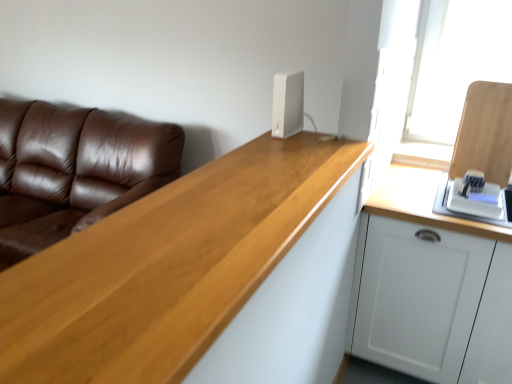
What do you see at coordinates (288, 104) in the screenshot? I see `white plastic router at upper center` at bounding box center [288, 104].

Identify the location of white plastic router at upper center. (288, 104).

Can you confirm if white plastic router at upper center is shorter than brown leather couch at left?

Indeed, white plastic router at upper center has a lesser height compared to brown leather couch at left.

In the image, is white plastic router at upper center positioned in front of or behind brown leather couch at left?

white plastic router at upper center is in front of brown leather couch at left.

Identify the location of appliance located above the brown leather couch at left (from a real-world perspective). (288, 104).

Is white plastic router at upper center in contact with brown leather couch at left?

white plastic router at upper center and brown leather couch at left are not in contact.

Is brown leather couch at left positioned far away from light wood countertop at center?

That's right, there is a large distance between brown leather couch at left and light wood countertop at center.

Is brown leather couch at left to the right of light wood countertop at center from the viewer's perspective?

Incorrect, brown leather couch at left is not on the right side of light wood countertop at center.

Is white plastic router at upper center not inside white matte cabinet at right?

Yes, white plastic router at upper center is located beyond the bounds of white matte cabinet at right.

Is white plastic router at upper center to the left or to the right of white matte cabinet at right in the image?

From the image, it's evident that white plastic router at upper center is to the left of white matte cabinet at right.

Can you see brown leather couch at left touching white plastic router at upper center?

No, brown leather couch at left is not with white plastic router at upper center.

Is brown leather couch at left wider than white plastic router at upper center?

Correct, the width of brown leather couch at left exceeds that of white plastic router at upper center.

From a real-world perspective, is brown leather couch at left beneath white plastic router at upper center?

Correct, in the physical world, brown leather couch at left is lower than white plastic router at upper center.

From the image's perspective, which is below, brown leather couch at left or white plastic router at upper center?

brown leather couch at left is shown below in the image.

Is white matte cabinet at right smaller than brown leather couch at left?

Indeed, white matte cabinet at right has a smaller size compared to brown leather couch at left.

Which of these two, white matte cabinet at right or brown leather couch at left, stands shorter?

white matte cabinet at right is shorter.

Is white matte cabinet at right far from brown leather couch at left?

Absolutely, white matte cabinet at right is distant from brown leather couch at left.

At what (x,y) coordinates should I click in order to perform the action: click on studio couch behind the white matte cabinet at right. Please return your answer as a coordinate pair (x, y). This screenshot has height=384, width=512. Looking at the image, I should click on (74, 170).

From the image's perspective, which object appears higher, brown leather couch at left or white matte cabinet at right?

brown leather couch at left, from the image's perspective.

Looking at this image, does brown leather couch at left have a larger size compared to white matte cabinet at right?

Yes.

Which is behind, brown leather couch at left or white matte cabinet at right?

brown leather couch at left is behind.

Can you confirm if brown leather couch at left is thinner than white matte cabinet at right?

No.

Which of these two, white matte cabinet at right or white plastic router at upper center, stands shorter?

With less height is white plastic router at upper center.

Considering the relative positions of white matte cabinet at right and white plastic router at upper center in the image provided, is white matte cabinet at right behind white plastic router at upper center?

No, it is in front of white plastic router at upper center.

Does white matte cabinet at right have a greater width compared to white plastic router at upper center?

Correct, the width of white matte cabinet at right exceeds that of white plastic router at upper center.

Considering the sizes of white matte cabinet at right and white plastic router at upper center in the image, is white matte cabinet at right bigger or smaller than white plastic router at upper center?

Clearly, white matte cabinet at right is larger in size than white plastic router at upper center.

Find the location of a particular element. The image size is (512, 384). studio couch located below the white plastic router at upper center (from the image's perspective) is located at coordinates (74, 170).

The height and width of the screenshot is (384, 512). I want to click on studio couch that appears on the left of light wood countertop at center, so click(x=74, y=170).

From the image, which object appears to be nearer to brown leather couch at left, white matte cabinet at right or light wood countertop at center?

Among the two, light wood countertop at center is located nearer to brown leather couch at left.

Which object lies nearer to the anchor point white matte cabinet at right, light wood countertop at center or white plastic router at upper center?

light wood countertop at center is closer to white matte cabinet at right.

From the image, which object appears to be farther from brown leather couch at left, white plastic router at upper center or light wood countertop at center?

light wood countertop at center is positioned further to the anchor brown leather couch at left.

Which object lies further to the anchor point light wood countertop at center, white matte cabinet at right or brown leather couch at left?

brown leather couch at left is positioned further to the anchor light wood countertop at center.

Considering their positions, is white plastic router at upper center positioned closer to white matte cabinet at right than brown leather couch at left?

white plastic router at upper center is positioned closer to the anchor white matte cabinet at right.

When comparing their distances from light wood countertop at center, does brown leather couch at left or white plastic router at upper center seem closer?

white plastic router at upper center is positioned closer to the anchor light wood countertop at center.

From the image, which object appears to be farther from white plastic router at upper center, brown leather couch at left or light wood countertop at center?

brown leather couch at left.

Estimate the real-world distances between objects in this image. Which object is closer to white plastic router at upper center, light wood countertop at center or brown leather couch at left?

light wood countertop at center lies closer to white plastic router at upper center than the other object.

I want to click on cabinetry positioned between light wood countertop at center and white plastic router at upper center from near to far, so click(426, 300).

Where is `countertop located between brown leather couch at left and white matte cabinet at right in the left-right direction`? This screenshot has width=512, height=384. countertop located between brown leather couch at left and white matte cabinet at right in the left-right direction is located at coordinates (166, 267).

You are a GUI agent. You are given a task and a screenshot of the screen. Output one action in this format:
    pyautogui.click(x=<x>, y=<y>)
    Task: Click on the appliance between brown leather couch at left and white matte cabinet at right in the horizontal direction
    
    Given the screenshot: What is the action you would take?
    pyautogui.click(x=288, y=104)

Identify the location of countertop between brown leather couch at left and white plastic router at upper center from left to right. This screenshot has height=384, width=512. (166, 267).